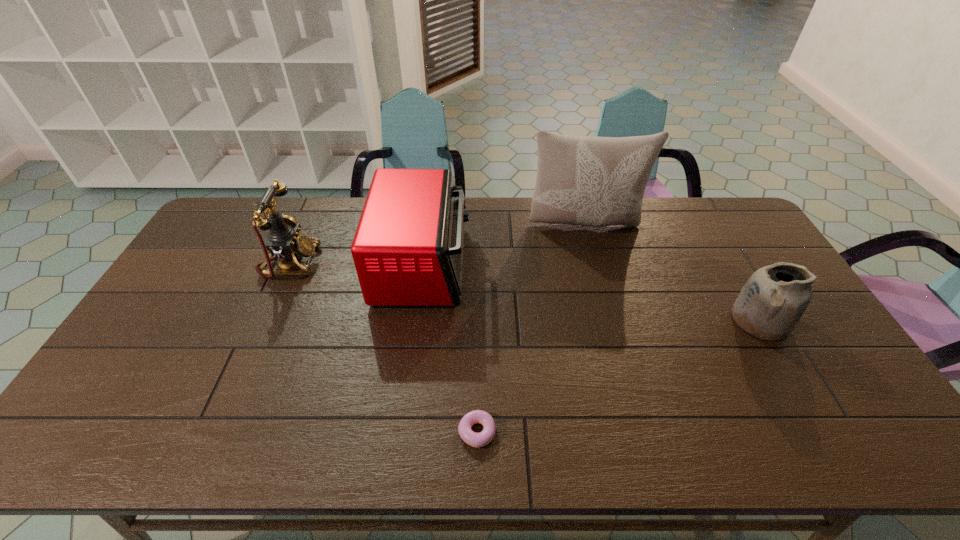
You are a GUI agent. You are given a task and a screenshot of the screen. Output one action in this format:
    pyautogui.click(x=<x>, y=<y>)
    Task: Click on the second object from right to left
    
    Given the screenshot: What is the action you would take?
    pyautogui.click(x=581, y=180)

The width and height of the screenshot is (960, 540). Identify the location of cushion. (581, 180).

The width and height of the screenshot is (960, 540). Identify the location of telephone. (283, 241).

Locate an element on the screen. The image size is (960, 540). toaster oven is located at coordinates (408, 247).

You are a GUI agent. You are given a task and a screenshot of the screen. Output one action in this format:
    pyautogui.click(x=<x>, y=<y>)
    Task: Click on the rightmost object
    
    Given the screenshot: What is the action you would take?
    pyautogui.click(x=773, y=300)

Find the location of a particular element. the fourth tallest object is located at coordinates (773, 300).

The image size is (960, 540). What are the coordinates of `doughnut` in the screenshot? It's located at (474, 439).

The width and height of the screenshot is (960, 540). Find the location of `the shortest object`. the shortest object is located at coordinates (474, 439).

Where is `free space located on the front side of the second object from right to left`? The image size is (960, 540). free space located on the front side of the second object from right to left is located at coordinates (593, 255).

The height and width of the screenshot is (540, 960). I want to click on vacant space situated on the front of the leftmost object, featuring the rotary dial, so click(424, 263).